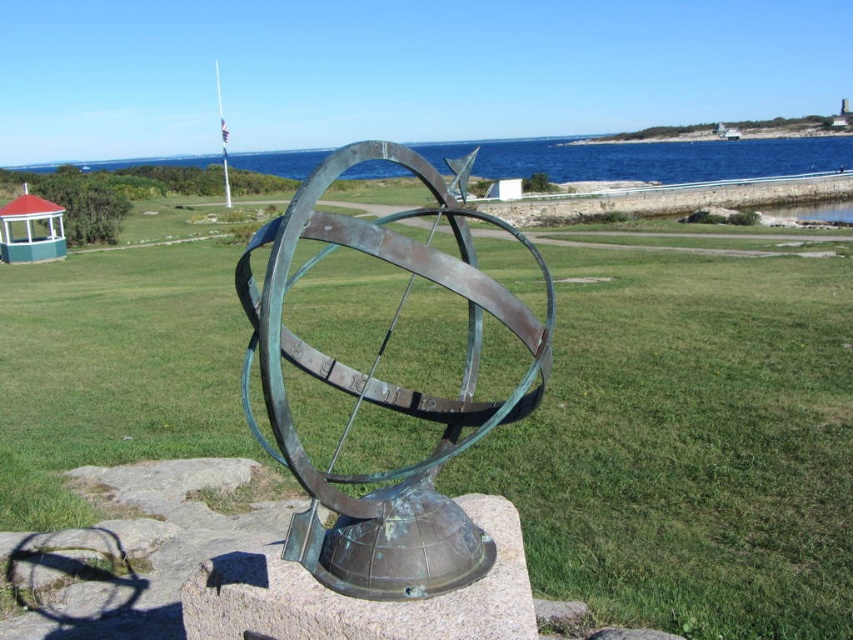
Image resolution: width=853 pixels, height=640 pixels. What do you see at coordinates (689, 444) in the screenshot?
I see `green grass at center` at bounding box center [689, 444].

Is green grass at center to the right of bronze/green patina sphere at center from the viewer's perspective?

No, green grass at center is not to the right of bronze/green patina sphere at center.

The image size is (853, 640). What do you see at coordinates (689, 444) in the screenshot?
I see `green grass at center` at bounding box center [689, 444].

Identify the location of green grass at center. (689, 444).

Is bronze/textured stone at center wider than blue water at upper center?

Incorrect, bronze/textured stone at center's width does not surpass blue water at upper center's.

Does point (235, 625) come farther from viewer compared to point (456, 145)?

No.

What are the coordinates of `bronze/textured stone at center` in the screenshot? It's located at (361, 598).

Does green grass at center appear on the right side of blue water at upper center?

Correct, you'll find green grass at center to the right of blue water at upper center.

Can you confirm if green grass at center is smaller than blue water at upper center?

Yes, green grass at center is smaller than blue water at upper center.

Is point (26, 397) positioned behind point (804, 166)?

No, it is not.

Where is `green grass at center`? green grass at center is located at coordinates (689, 444).